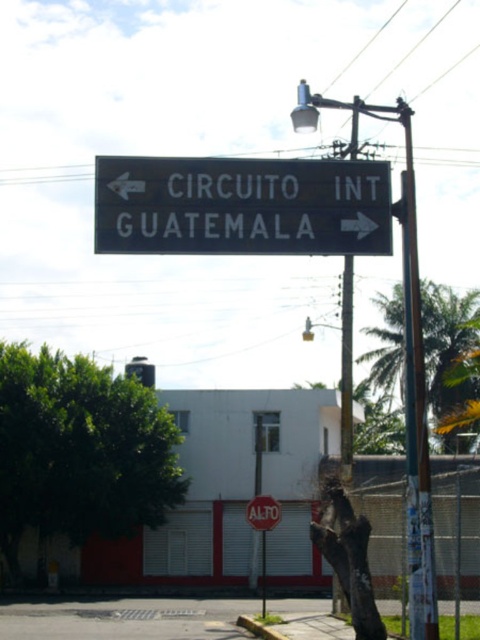
Who is positioned more to the right, black metal sign at center or red matte stop sign at center?

red matte stop sign at center

Is black metal sign at center below red matte stop sign at center?

No, black metal sign at center is not below red matte stop sign at center.

The width and height of the screenshot is (480, 640). What do you see at coordinates (241, 205) in the screenshot?
I see `black metal sign at center` at bounding box center [241, 205].

Identify the location of black metal sign at center. (241, 205).